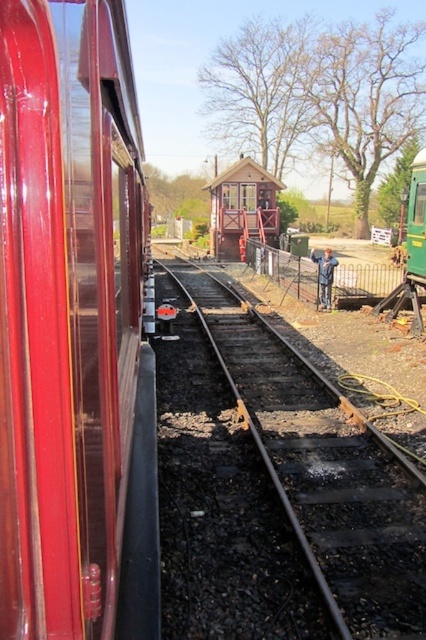
Question: Among these points, which one is farthest from the camera?

Choices:
 (A) (405, 541)
 (B) (132, 321)

Answer: (B)

Question: Does shiny red train car at left appear on the right side of green matte train at center?

Choices:
 (A) no
 (B) yes

Answer: (A)

Question: Which object is positioned farthest from the green matte train at center?

Choices:
 (A) shiny red train car at left
 (B) black metal track at center

Answer: (A)

Question: Does shiny red train car at left have a lesser width compared to green matte train at center?

Choices:
 (A) yes
 (B) no

Answer: (A)

Question: Based on their relative distances, which object is farther from the black metal track at center?

Choices:
 (A) green matte train at center
 (B) shiny red train car at left

Answer: (A)

Question: Can you confirm if shiny red train car at left is bigger than black metal track at center?

Choices:
 (A) no
 (B) yes

Answer: (A)